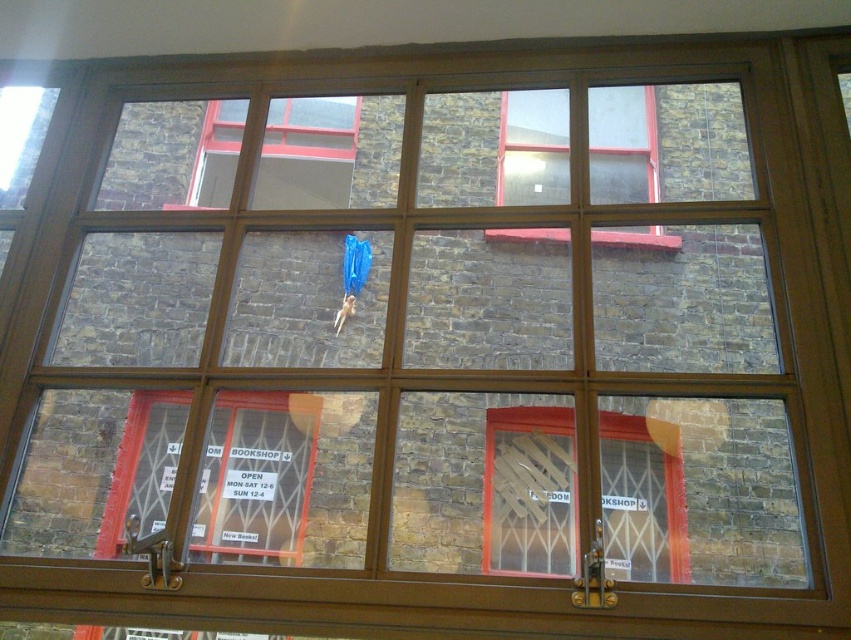
Question: Considering the real-world distances, which object is closest to the clear glass window at upper center?

Choices:
 (A) matte glass window at upper left
 (B) clear glass window at center

Answer: (A)

Question: Can you confirm if clear glass window at center is positioned to the left of matte glass window at upper left?

Choices:
 (A) no
 (B) yes

Answer: (A)

Question: Can you confirm if clear glass window at center is positioned below matte glass window at upper left?

Choices:
 (A) no
 (B) yes

Answer: (B)

Question: Is clear glass window at center wider than matte glass window at upper left?

Choices:
 (A) yes
 (B) no

Answer: (B)

Question: Which object appears farthest from the camera in this image?

Choices:
 (A) clear glass window at upper center
 (B) matte glass window at upper left

Answer: (B)

Question: Which of the following is the farthest from the observer?

Choices:
 (A) clear glass window at upper center
 (B) matte glass window at upper left
 (C) clear glass window at center

Answer: (B)